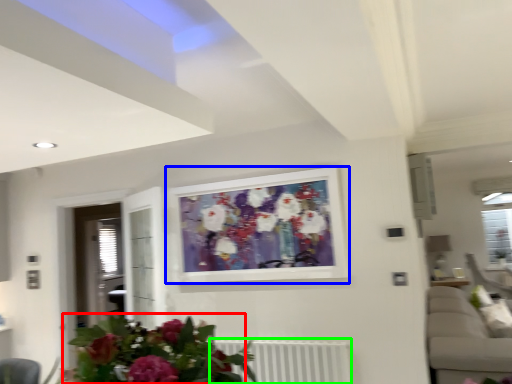
Question: Based on their relative distances, which object is farther from floral arrangement (highlighted by a red box)? Choose from picture frame (highlighted by a blue box) and radiator (highlighted by a green box).

Choices:
 (A) picture frame
 (B) radiator

Answer: (A)